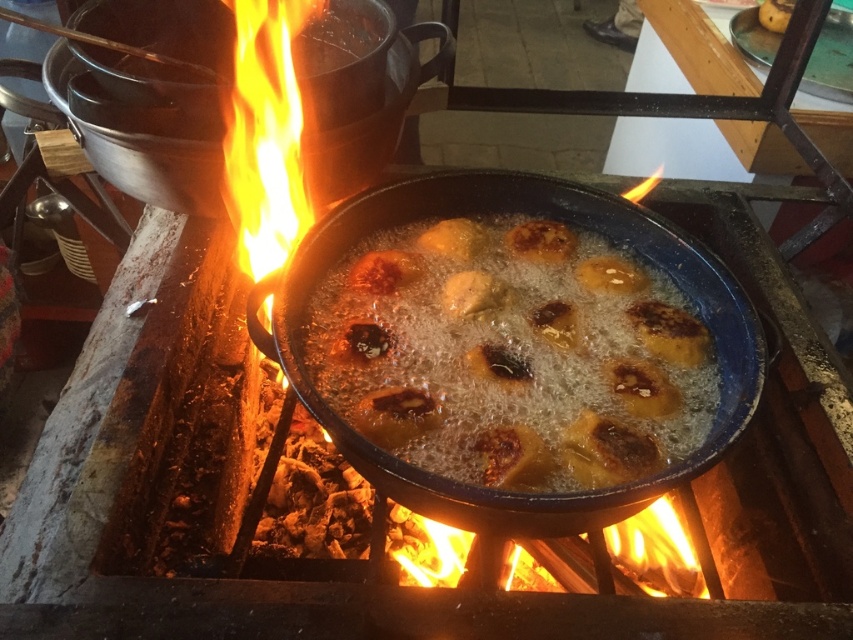
Question: Considering the relative positions of golden crispy pastry at center and black cast iron frying pan at center in the image provided, where is golden crispy pastry at center located with respect to black cast iron frying pan at center?

Choices:
 (A) above
 (B) below

Answer: (B)

Question: Does golden crispy pastry at center have a smaller size compared to black cast iron frying pan at center?

Choices:
 (A) no
 (B) yes

Answer: (B)

Question: From the image, what is the correct spatial relationship of golden crispy pastry at center in relation to black cast iron frying pan at center?

Choices:
 (A) left
 (B) right

Answer: (B)

Question: Which point is farther to the camera?

Choices:
 (A) golden crispy pastry at center
 (B) black cast iron frying pan at center

Answer: (B)

Question: Which point is farther to the camera?

Choices:
 (A) pos(331,390)
 (B) pos(299,65)

Answer: (B)